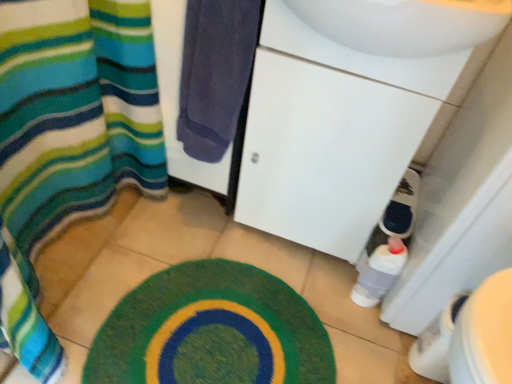
The image size is (512, 384). What are the coordinates of `dark blue towel at center` in the screenshot? It's located at (215, 73).

Image resolution: width=512 pixels, height=384 pixels. I want to click on striped fabric shower curtain at left, so click(x=68, y=140).

The height and width of the screenshot is (384, 512). What do you see at coordinates (211, 330) in the screenshot? I see `green fuzzy bath mat at lower center` at bounding box center [211, 330].

This screenshot has width=512, height=384. I want to click on green fuzzy bath mat at lower center, so click(211, 330).

Describe the element at coordinates (350, 108) in the screenshot. Image resolution: width=512 pixels, height=384 pixels. I see `white glossy sink at center` at that location.

At what (x,y) coordinates should I click in order to perform the action: click on translucent plastic bottle at lower right. Please return your answer as a coordinate pair (x, y). The height and width of the screenshot is (384, 512). Looking at the image, I should click on (379, 272).

Locate an element on the screen. The width and height of the screenshot is (512, 384). dark blue towel at center is located at coordinates (215, 73).

Is the depth of dark blue towel at center less than that of striped fabric shower curtain at left?

That is True.

Is dark blue towel at center far from striped fabric shower curtain at left?

No, there isn't a large distance between dark blue towel at center and striped fabric shower curtain at left.

Is dark blue towel at center bigger than striped fabric shower curtain at left?

Correct, dark blue towel at center is larger in size than striped fabric shower curtain at left.

Find the location of a particular element. The height and width of the screenshot is (384, 512). towel above the striped fabric shower curtain at left (from the image's perspective) is located at coordinates (215, 73).

Is striped fabric shower curtain at left directly adjacent to dark blue towel at center?

striped fabric shower curtain at left and dark blue towel at center are not in contact.

Is striped fabric shower curtain at left inside the boundaries of dark blue towel at center, or outside?

The correct answer is: outside.

Between striped fabric shower curtain at left and dark blue towel at center, which one has smaller size?

With smaller size is striped fabric shower curtain at left.

How different are the orientations of striped fabric shower curtain at left and dark blue towel at center in degrees?

0.472 degrees separate the facing orientations of striped fabric shower curtain at left and dark blue towel at center.

From the image's perspective, is striped fabric shower curtain at left under translucent plastic bottle at lower right?

Incorrect, from the image's perspective, striped fabric shower curtain at left is higher than translucent plastic bottle at lower right.

Does striped fabric shower curtain at left appear on the right side of translucent plastic bottle at lower right?

No, striped fabric shower curtain at left is not to the right of translucent plastic bottle at lower right.

Is striped fabric shower curtain at left next to translucent plastic bottle at lower right?

No, striped fabric shower curtain at left is not touching translucent plastic bottle at lower right.

Is translucent plastic bottle at lower right in contact with green fuzzy bath mat at lower center?

No, translucent plastic bottle at lower right is not with green fuzzy bath mat at lower center.

Does point (392, 265) appear closer or farther from the camera than point (197, 264)?

Point (392, 265) is closer to the camera than point (197, 264).

Is translucent plastic bottle at lower right completely or partially outside of green fuzzy bath mat at lower center?

translucent plastic bottle at lower right lies outside green fuzzy bath mat at lower center's area.

The image size is (512, 384). I want to click on bottle above the green fuzzy bath mat at lower center (from the image's perspective), so click(379, 272).

From their relative heights in the image, would you say translucent plastic bottle at lower right is taller or shorter than white glossy sink at center?

Clearly, translucent plastic bottle at lower right is shorter compared to white glossy sink at center.

Is point (399, 251) closer to camera compared to point (354, 158)?

No.

Based on the photo, can you see translucent plastic bottle at lower right touching white glossy sink at center?

translucent plastic bottle at lower right and white glossy sink at center are clearly separated.

How many degrees apart are the facing directions of translucent plastic bottle at lower right and white glossy sink at center?

They differ by 0.105 degrees in their facing directions.

From the image's perspective, which is above, white glossy sink at center or green fuzzy bath mat at lower center?

white glossy sink at center appears higher in the image.

Does white glossy sink at center have a smaller size compared to green fuzzy bath mat at lower center?

Actually, white glossy sink at center might be larger than green fuzzy bath mat at lower center.

Would you say white glossy sink at center is a long distance from green fuzzy bath mat at lower center?

That's not correct — white glossy sink at center is a little close to green fuzzy bath mat at lower center.

How many degrees apart are the facing directions of white glossy sink at center and green fuzzy bath mat at lower center?

89.9 degrees separate the facing orientations of white glossy sink at center and green fuzzy bath mat at lower center.

Between green fuzzy bath mat at lower center and white glossy sink at center, which one appears on the right side from the viewer's perspective?

white glossy sink at center.

From the image's perspective, which one is positioned higher, green fuzzy bath mat at lower center or white glossy sink at center?

white glossy sink at center is shown above in the image.

Consider the image. From a real-world perspective, who is located lower, green fuzzy bath mat at lower center or white glossy sink at center?

green fuzzy bath mat at lower center is physically lower.

Looking at the image, does green fuzzy bath mat at lower center seem bigger or smaller compared to white glossy sink at center?

In the image, green fuzzy bath mat at lower center appears to be smaller than white glossy sink at center.

Image resolution: width=512 pixels, height=384 pixels. Identify the location of curtain that is behind the dark blue towel at center. (68, 140).

Locate an element on the screen. Image resolution: width=512 pixels, height=384 pixels. towel that is on the right side of striped fabric shower curtain at left is located at coordinates (215, 73).

Looking at the image, which one is located closer to translucent plastic bottle at lower right, green fuzzy bath mat at lower center or striped fabric shower curtain at left?

Among the two, green fuzzy bath mat at lower center is located nearer to translucent plastic bottle at lower right.

From the image, which object appears to be farther from translucent plastic bottle at lower right, green fuzzy bath mat at lower center or dark blue towel at center?

Based on the image, dark blue towel at center appears to be further to translucent plastic bottle at lower right.

When comparing their distances from translucent plastic bottle at lower right, does dark blue towel at center or striped fabric shower curtain at left seem further?

Among the two, striped fabric shower curtain at left is located further to translucent plastic bottle at lower right.

Which object lies further to the anchor point dark blue towel at center, white glossy sink at center or translucent plastic bottle at lower right?

translucent plastic bottle at lower right lies further to dark blue towel at center than the other object.

From the image, which object appears to be nearer to translucent plastic bottle at lower right, dark blue towel at center or green fuzzy bath mat at lower center?

green fuzzy bath mat at lower center lies closer to translucent plastic bottle at lower right than the other object.

Based on their spatial positions, is striped fabric shower curtain at left or green fuzzy bath mat at lower center further from translucent plastic bottle at lower right?

striped fabric shower curtain at left lies further to translucent plastic bottle at lower right than the other object.

When comparing their distances from white glossy sink at center, does translucent plastic bottle at lower right or dark blue towel at center seem further?

translucent plastic bottle at lower right is further to white glossy sink at center.

Considering their positions, is white glossy sink at center positioned further to dark blue towel at center than striped fabric shower curtain at left?

striped fabric shower curtain at left lies further to dark blue towel at center than the other object.

Locate an element on the screen. This screenshot has height=384, width=512. bottle between dark blue towel at center and green fuzzy bath mat at lower center from top to bottom is located at coordinates (379, 272).

Locate an element on the screen. bath mat between striped fabric shower curtain at left and translucent plastic bottle at lower right in the horizontal direction is located at coordinates (211, 330).

Image resolution: width=512 pixels, height=384 pixels. I want to click on towel located between striped fabric shower curtain at left and translucent plastic bottle at lower right in the left-right direction, so click(x=215, y=73).

I want to click on bath mat situated between striped fabric shower curtain at left and white glossy sink at center from left to right, so click(211, 330).